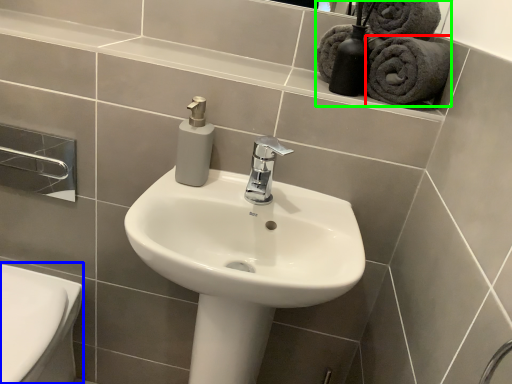
Question: Estimate the real-world distances between objects in this image. Which object is farther from bath towel (highlighted by a red box), bidet (highlighted by a blue box) or bath towel (highlighted by a green box)?

Choices:
 (A) bidet
 (B) bath towel

Answer: (A)